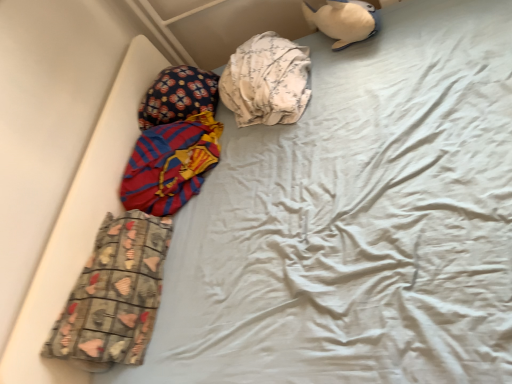
Question: Which direction should I rotate to face white floral fabric at center, positioned as the third material in bottom-to-top order, — up or down?

Choices:
 (A) down
 (B) up

Answer: (B)

Question: Could printed fabric pants at lower left, acting as the third material starting from the top, be considered to be inside red and blue striped fabric at left, which ranks as the 2th material in bottom-to-top order?

Choices:
 (A) no
 (B) yes

Answer: (A)

Question: Considering the relative sizes of red and blue striped fabric at left, the 2th material when ordered from top to bottom, and printed fabric pants at lower left, positioned as the 1th material in bottom-to-top order, in the image provided, is red and blue striped fabric at left, the 2th material when ordered from top to bottom, shorter than printed fabric pants at lower left, positioned as the 1th material in bottom-to-top order,?

Choices:
 (A) no
 (B) yes

Answer: (B)

Question: Considering the relative sizes of red and blue striped fabric at left, which ranks as the 2th material in bottom-to-top order, and printed fabric pants at lower left, positioned as the 1th material in bottom-to-top order, in the image provided, is red and blue striped fabric at left, which ranks as the 2th material in bottom-to-top order, smaller than printed fabric pants at lower left, positioned as the 1th material in bottom-to-top order,?

Choices:
 (A) no
 (B) yes

Answer: (A)

Question: Is red and blue striped fabric at left, the 2th material when ordered from top to bottom, at the left side of printed fabric pants at lower left, positioned as the 1th material in bottom-to-top order?

Choices:
 (A) yes
 (B) no

Answer: (B)

Question: Does red and blue striped fabric at left, the 2th material when ordered from top to bottom, have a greater height compared to printed fabric pants at lower left, positioned as the 1th material in bottom-to-top order?

Choices:
 (A) no
 (B) yes

Answer: (A)

Question: From a real-world perspective, is red and blue striped fabric at left, the 2th material when ordered from top to bottom, below printed fabric pants at lower left, acting as the third material starting from the top?

Choices:
 (A) yes
 (B) no

Answer: (A)

Question: Can you confirm if white floral fabric at center, positioned as the third material in bottom-to-top order, is wider than fluffy fabric pillow at upper left?

Choices:
 (A) yes
 (B) no

Answer: (A)

Question: Is white floral fabric at center, positioned as the third material in bottom-to-top order, smaller than fluffy fabric pillow at upper left?

Choices:
 (A) yes
 (B) no

Answer: (B)

Question: Can you confirm if white floral fabric at center, positioned as the third material in bottom-to-top order, is thinner than fluffy fabric pillow at upper left?

Choices:
 (A) no
 (B) yes

Answer: (A)

Question: Are white floral fabric at center, the 1th material in the top-to-bottom sequence, and fluffy fabric pillow at upper left far apart?

Choices:
 (A) no
 (B) yes

Answer: (A)

Question: From the image's perspective, is white floral fabric at center, positioned as the third material in bottom-to-top order, over fluffy fabric pillow at upper left?

Choices:
 (A) no
 (B) yes

Answer: (B)

Question: Is fluffy fabric pillow at upper left located within white floral fabric at center, positioned as the third material in bottom-to-top order?

Choices:
 (A) no
 (B) yes

Answer: (A)

Question: Does red and blue striped fabric at left, which ranks as the 2th material in bottom-to-top order, have a lesser width compared to fluffy fabric pillow at upper left?

Choices:
 (A) yes
 (B) no

Answer: (B)